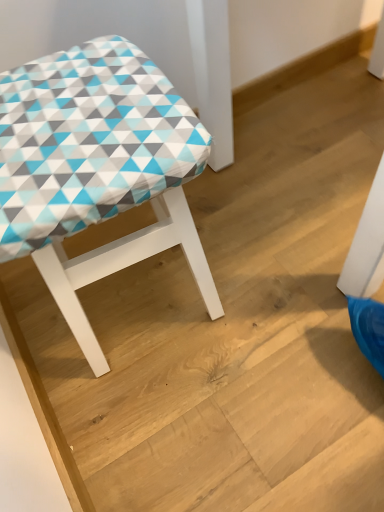
Describe the element at coordinates (96, 169) in the screenshot. I see `matte fabric stool at center` at that location.

In order to face matte fabric stool at center, should I rotate leftwards or rightwards?

You should look left and rotate roughly 11.326 degrees.

Find the location of a particular element. matte fabric stool at center is located at coordinates (96, 169).

Locate an element on the screen. The width and height of the screenshot is (384, 512). matte fabric stool at center is located at coordinates (96, 169).